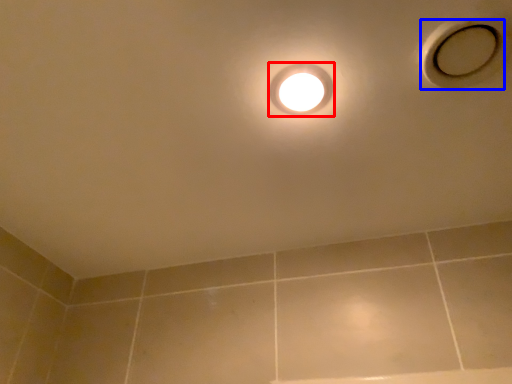
Question: Which object appears farthest to the camera in this image, droplight (highlighted by a red box) or hole (highlighted by a blue box)?

Choices:
 (A) droplight
 (B) hole

Answer: (A)